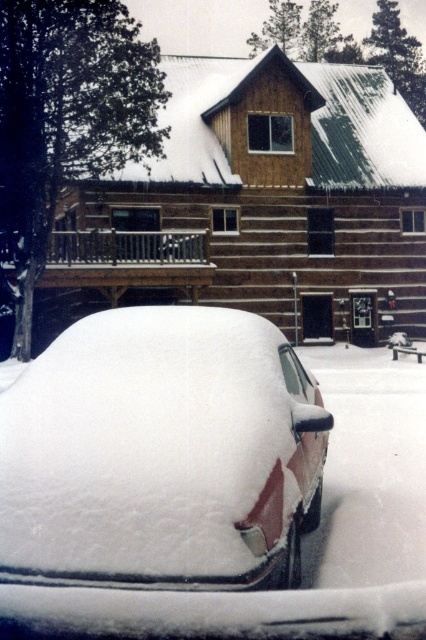
Question: Which point is farther to the camera?

Choices:
 (A) snow-covered car at center
 (B) wooden cabin at center

Answer: (B)

Question: Among these points, which one is nearest to the camera?

Choices:
 (A) (416, 118)
 (B) (262, 564)

Answer: (B)

Question: Is wooden cabin at center wider than snow-covered car at center?

Choices:
 (A) no
 (B) yes

Answer: (B)

Question: Does wooden cabin at center appear under snow-covered car at center?

Choices:
 (A) no
 (B) yes

Answer: (A)

Question: Can you confirm if wooden cabin at center is positioned above snow-covered car at center?

Choices:
 (A) no
 (B) yes

Answer: (B)